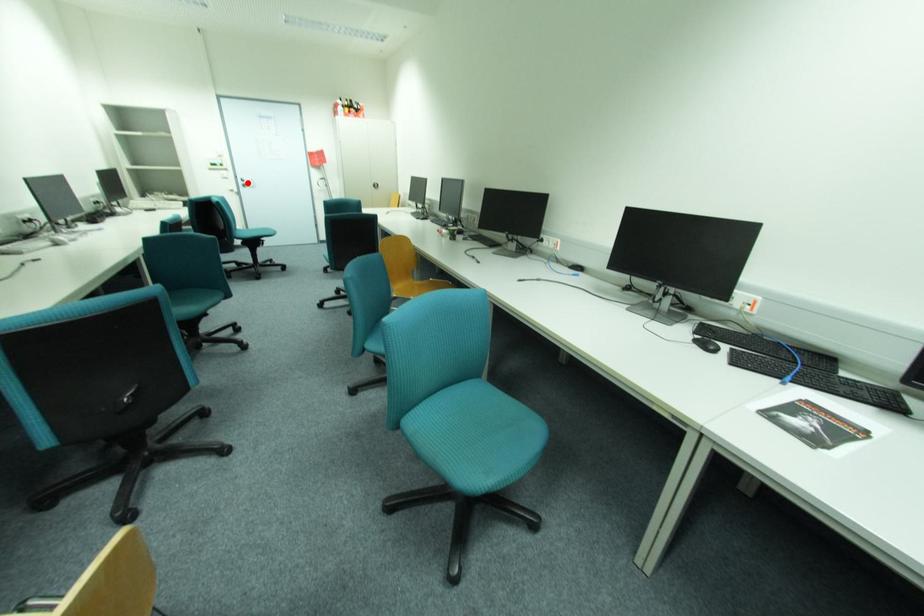
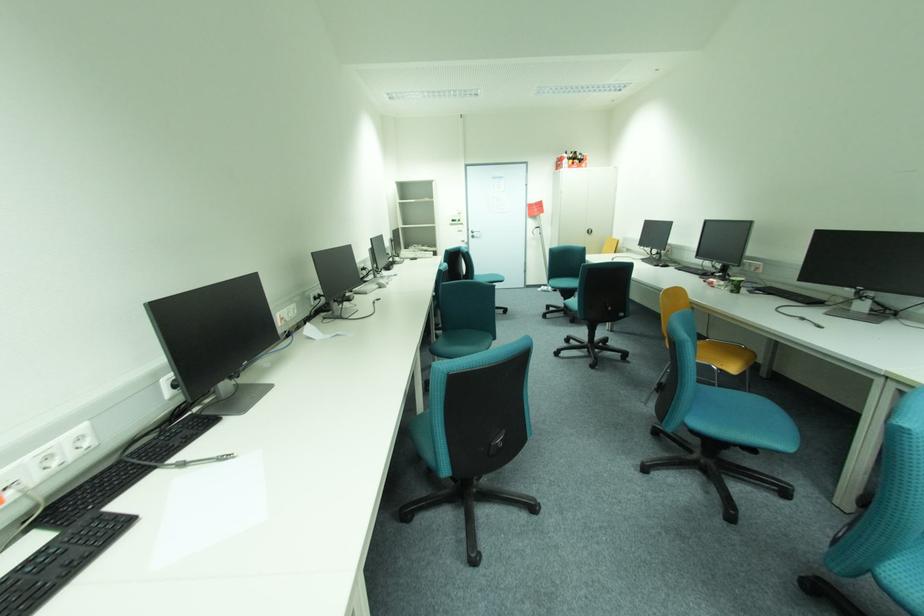
Where in the second image is the point corresponding to the highlighted location from the first image?

(477, 235)